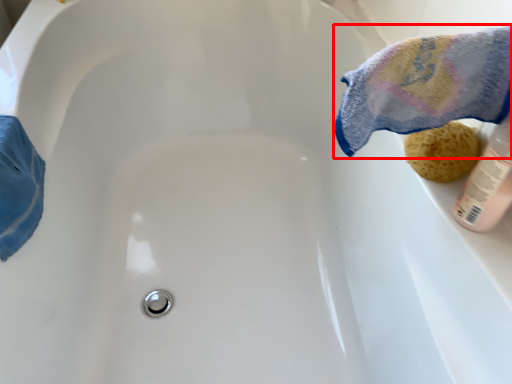
Question: From the image's perspective, what is the correct spatial relationship of bath towel (annotated by the red box) in relation to stuff?

Choices:
 (A) above
 (B) below

Answer: (A)